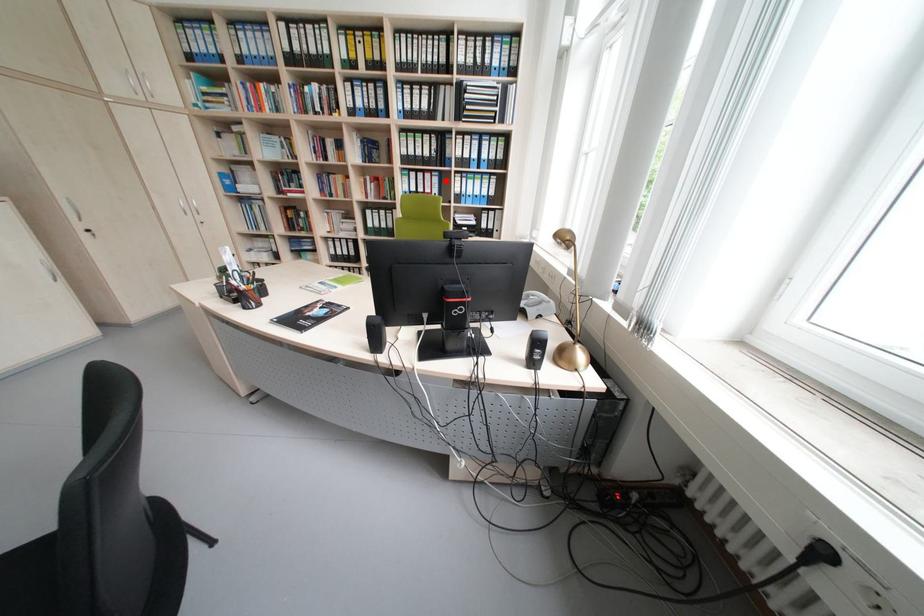
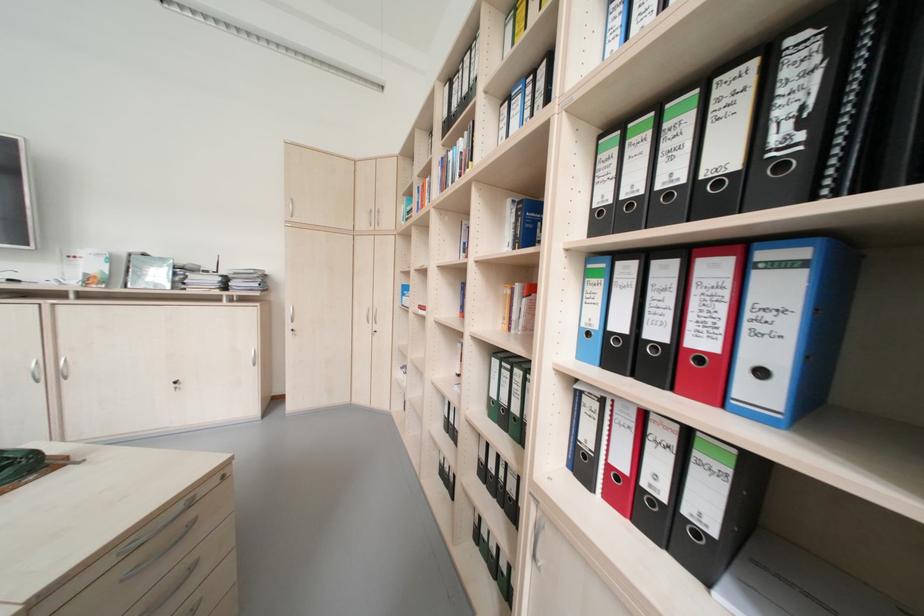
Question: I am providing you with two images of the same scene from different viewpoints. Image1 has a red point marked. In image2, the corresponding 3D location appears at what relative position? Reply with the corresponding letter.

Choices:
 (A) Closer
 (B) Farther

Answer: (B)